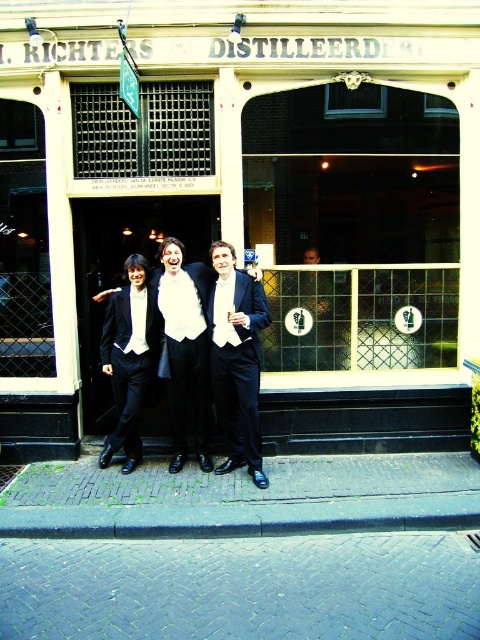
Is matte black glass at center above matte black suit at center?

Correct, matte black glass at center is located above matte black suit at center.

Who is more forward, (268, 433) or (112, 292)?

Positioned in front is point (112, 292).

This screenshot has width=480, height=640. What are the coordinates of `matte black glass at center` in the screenshot? It's located at (248, 202).

Locate an element on the screen. The image size is (480, 640). matte black glass at center is located at coordinates (248, 202).

Can you confirm if black satin suit at center is thinner than matte black suit at center?

Correct, black satin suit at center's width is less than matte black suit at center's.

Is point (165, 330) positioned behind point (136, 404)?

Yes, it is behind point (136, 404).

Does point (190, 292) lie in front of point (119, 323)?

That is True.

Where is `black satin suit at center`? This screenshot has width=480, height=640. black satin suit at center is located at coordinates (184, 348).

Based on the photo, which is above, matte black glass at center or black satin suit at center?

matte black glass at center is higher up.

What do you see at coordinates (248, 202) in the screenshot? I see `matte black glass at center` at bounding box center [248, 202].

Locate an element on the screen. This screenshot has height=640, width=480. matte black glass at center is located at coordinates (248, 202).